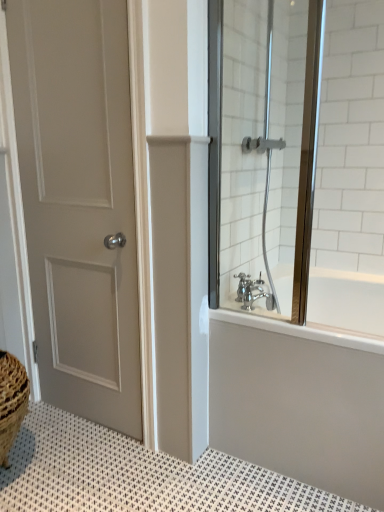
The image size is (384, 512). I want to click on clear glass shower door at right, so click(x=298, y=158).

Where is `bathtub on the right of clear glass shower door at right`? Image resolution: width=384 pixels, height=512 pixels. bathtub on the right of clear glass shower door at right is located at coordinates (299, 402).

Between white glossy bathtub at upper right and clear glass shower door at right, which one appears on the left side from the viewer's perspective?

Positioned to the left is clear glass shower door at right.

From the image's perspective, is white glossy bathtub at upper right on clear glass shower door at right?

Actually, white glossy bathtub at upper right appears below clear glass shower door at right in the image.

Considering the sizes of objects white glossy bathtub at upper right and clear glass shower door at right in the image provided, who is shorter, white glossy bathtub at upper right or clear glass shower door at right?

With less height is white glossy bathtub at upper right.

Is white glossy bathtub at upper right in front of or behind silver metallic faucet at lower right in the image?

Visually, white glossy bathtub at upper right is located in front of silver metallic faucet at lower right.

Between white glossy bathtub at upper right and silver metallic faucet at lower right, which one has larger width?

With larger width is white glossy bathtub at upper right.

From the image's perspective, which object appears higher, white glossy bathtub at upper right or silver metallic faucet at lower right?

silver metallic faucet at lower right is shown above in the image.

Which is behind, white glossy bathtub at upper right or white textured bath mat at lower left?

white glossy bathtub at upper right.

Considering the points (308, 338) and (100, 465), which point is behind, point (308, 338) or point (100, 465)?

The point (100, 465) is farther.

From a real-world perspective, between white glossy bathtub at upper right and white textured bath mat at lower left, who is vertically higher?

white glossy bathtub at upper right is physically above.

In the scene shown: Does white glossy bathtub at upper right have a greater height compared to white textured bath mat at lower left?

Yes, white glossy bathtub at upper right is taller than white textured bath mat at lower left.

Is silver metallic faucet at lower right next to clear glass shower door at right?

silver metallic faucet at lower right and clear glass shower door at right are clearly separated.

How many degrees apart are the facing directions of silver metallic faucet at lower right and clear glass shower door at right?

The angular difference between silver metallic faucet at lower right and clear glass shower door at right is 122 degrees.

In the image, is silver metallic faucet at lower right on the left side or the right side of clear glass shower door at right?

In the image, silver metallic faucet at lower right appears on the right side of clear glass shower door at right.

Is silver metallic faucet at lower right further to the viewer compared to clear glass shower door at right?

Yes.

Which is closer, [289,56] or [254,280]?

Point [254,280]

Which of these two, clear glass shower door at right or silver metallic faucet at lower right, stands taller?

Standing taller between the two is clear glass shower door at right.

Locate an element on the screen. Image resolution: width=384 pixels, height=512 pixels. window screen on the left of silver metallic faucet at lower right is located at coordinates (298, 158).

Which is in front, clear glass shower door at right or silver metallic faucet at lower right?

clear glass shower door at right is in front.

Is silver metallic faucet at lower right not inside matte gray door at left?

Indeed, silver metallic faucet at lower right is completely outside matte gray door at left.

From the image's perspective, is silver metallic faucet at lower right located above matte gray door at left?

Incorrect, from the image's perspective, silver metallic faucet at lower right is lower than matte gray door at left.

Considering the positions of objects silver metallic faucet at lower right and matte gray door at left in the image provided, who is in front, silver metallic faucet at lower right or matte gray door at left?

matte gray door at left is more forward.

Which of these two, silver metallic faucet at lower right or matte gray door at left, is bigger?

matte gray door at left.

Is clear glass shower door at right far from white glossy bathtub at upper right?

They are positioned close to each other.

From the picture: Considering the sizes of objects clear glass shower door at right and white glossy bathtub at upper right in the image provided, who is bigger, clear glass shower door at right or white glossy bathtub at upper right?

Bigger between the two is white glossy bathtub at upper right.

Considering the sizes of objects clear glass shower door at right and white glossy bathtub at upper right in the image provided, who is shorter, clear glass shower door at right or white glossy bathtub at upper right?

With less height is white glossy bathtub at upper right.

Could you tell me if clear glass shower door at right is turned towards white glossy bathtub at upper right?

No, clear glass shower door at right is not oriented towards white glossy bathtub at upper right.

In the image, there is a clear glass shower door at right. At what (x,y) coordinates should I click in order to perform the action: click on bathtub below it (from a real-world perspective). Please return your answer as a coordinate pair (x, y). This screenshot has width=384, height=512. Looking at the image, I should click on (299, 402).

Image resolution: width=384 pixels, height=512 pixels. Identify the location of tap behind the white glossy bathtub at upper right. coord(253,292).

Looking at this image, based on their spatial positions, is matte gray door at left or silver metallic faucet at lower right further from clear glass shower door at right?

matte gray door at left is positioned further to the anchor clear glass shower door at right.

Which object lies further to the anchor point silver metallic faucet at lower right, clear glass shower door at right or white textured bath mat at lower left?

white textured bath mat at lower left is positioned further to the anchor silver metallic faucet at lower right.

Based on their spatial positions, is white glossy bathtub at upper right or clear glass shower door at right further from silver metallic faucet at lower right?

clear glass shower door at right lies further to silver metallic faucet at lower right than the other object.

Which object lies further to the anchor point white textured bath mat at lower left, silver metallic faucet at lower right or clear glass shower door at right?

Among the two, clear glass shower door at right is located further to white textured bath mat at lower left.

Which object lies further to the anchor point matte gray door at left, clear glass shower door at right or white textured bath mat at lower left?

Based on the image, clear glass shower door at right appears to be further to matte gray door at left.

When comparing their distances from white glossy bathtub at upper right, does matte gray door at left or silver metallic faucet at lower right seem closer?

silver metallic faucet at lower right is closer to white glossy bathtub at upper right.

Looking at the image, which one is located closer to silver metallic faucet at lower right, white glossy bathtub at upper right or matte gray door at left?

white glossy bathtub at upper right lies closer to silver metallic faucet at lower right than the other object.

When comparing their distances from silver metallic faucet at lower right, does clear glass shower door at right or white glossy bathtub at upper right seem closer?

white glossy bathtub at upper right is closer to silver metallic faucet at lower right.

The width and height of the screenshot is (384, 512). I want to click on bathtub between clear glass shower door at right and white textured bath mat at lower left in the up-down direction, so click(x=299, y=402).

Identify the location of tap between matte gray door at left and white textured bath mat at lower left in the vertical direction. Image resolution: width=384 pixels, height=512 pixels. (253, 292).

This screenshot has width=384, height=512. What are the coordinates of `bath mat between matte gray door at left and white glossy bathtub at upper right in the horizontal direction` in the screenshot? It's located at (139, 475).

In order to click on tap located between matte gray door at left and white glossy bathtub at upper right in the left-right direction in this screenshot , I will do `click(253, 292)`.